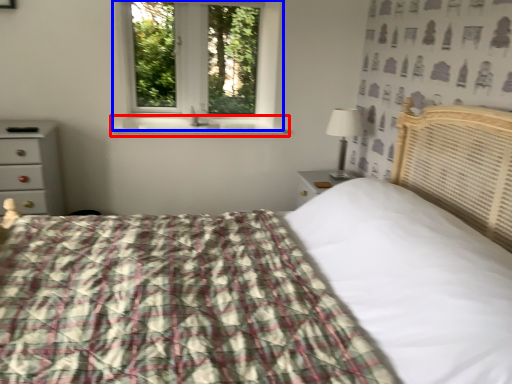
Question: Which of the following is the closest to the observer, window sill (highlighted by a red box) or window (highlighted by a blue box)?

Choices:
 (A) window sill
 (B) window

Answer: (A)